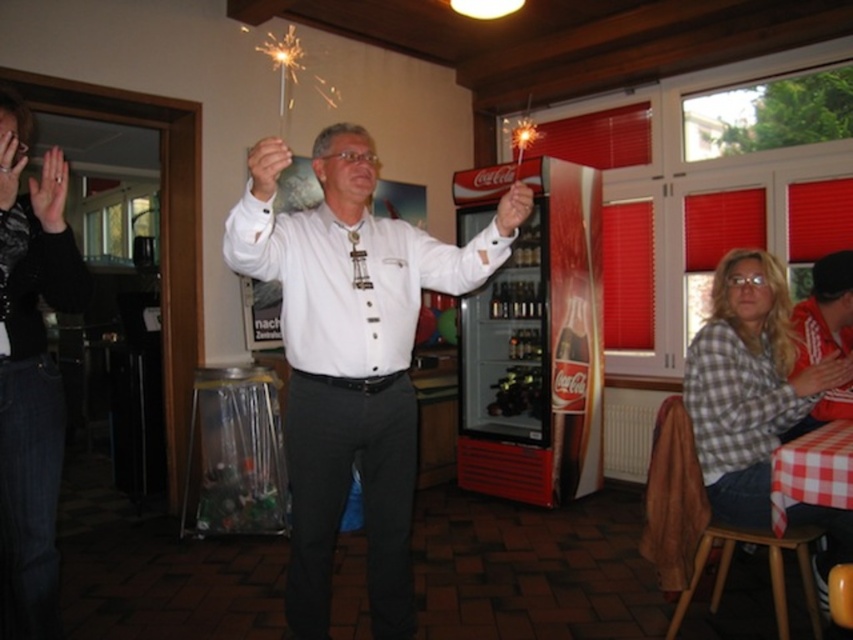
You are a photographer setting up for a group photo. You need to ensure that the white matte shirt at center and the black textured sweater at left are both visible in the frame. Based on their positions, which clothing item is closer to the camera?

The white matte shirt at center is positioned under the black textured sweater at left, so the black textured sweater at left is closer to the camera because it is above the white matte shirt at center.

You are at a party and want to hand a gift to the person wearing the checkered fabric shirt at lower right. To reach them, you need to walk around the black textured sweater at left. Which direction should you move first?

Since the black textured sweater at left is to the left of the checkered fabric shirt at lower right, you should move to the right to go around the black textured sweater at left and reach the checkered fabric shirt at lower right.

You are a photographer trying to capture both the black textured sweater at left and the checkered fabric shirt at lower right in a single frame. Based on their positions, will you need to adjust your camera angle upwards or downwards to include both in the shot?

The black textured sweater at left is located above the checkered fabric shirt at lower right, so you will need to adjust your camera angle downwards to ensure both are visible in the frame.